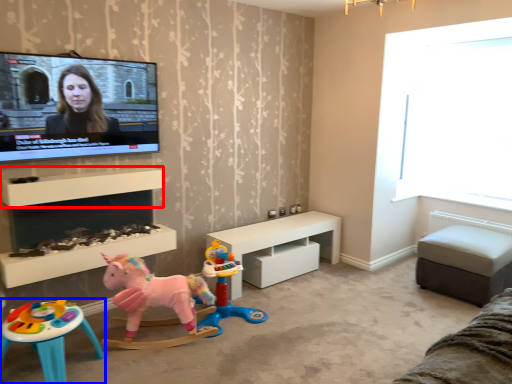
Question: Which object appears closest to the camera in this image, shelf (highlighted by a red box) or toy (highlighted by a blue box)?

Choices:
 (A) shelf
 (B) toy

Answer: (B)